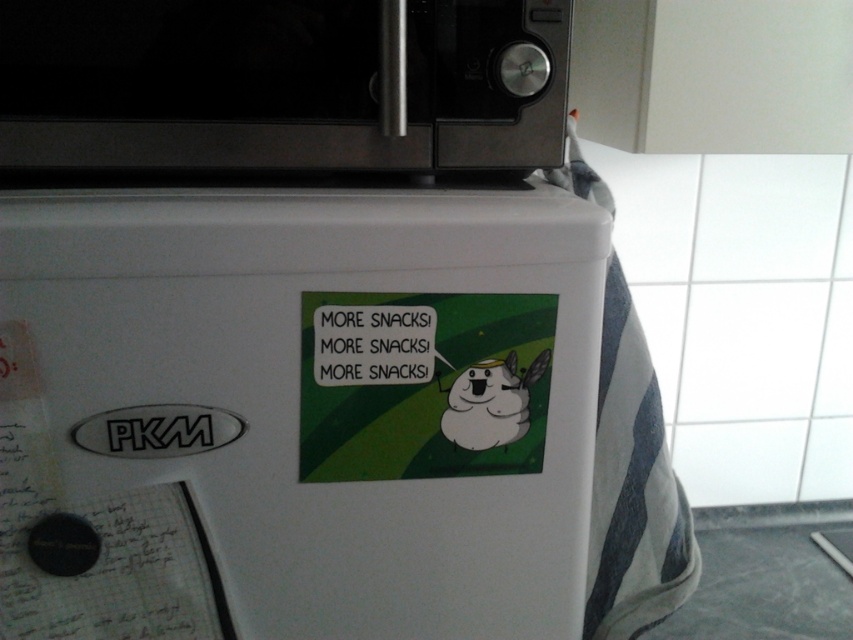
Can you confirm if black matte microwave at upper center is thinner than green matte sticker at center?

No.

Locate an element on the screen. This screenshot has height=640, width=853. black matte microwave at upper center is located at coordinates (283, 84).

Does white matte refrigerator at center have a lesser width compared to black matte microwave at upper center?

Incorrect, white matte refrigerator at center's width is not less than black matte microwave at upper center's.

Which is behind, point (424, 541) or point (494, 76)?

The point (424, 541) is more distant.

Identify the location of white matte refrigerator at center. The height and width of the screenshot is (640, 853). (293, 413).

Is white matte refrigerator at center shorter than green matte sticker at center?

No, white matte refrigerator at center is not shorter than green matte sticker at center.

Does white matte refrigerator at center have a larger size compared to green matte sticker at center?

Correct, white matte refrigerator at center is larger in size than green matte sticker at center.

Who is more distant from viewer, (462, 508) or (323, 349)?

Point (462, 508)

Identify the location of white matte refrigerator at center. (293, 413).